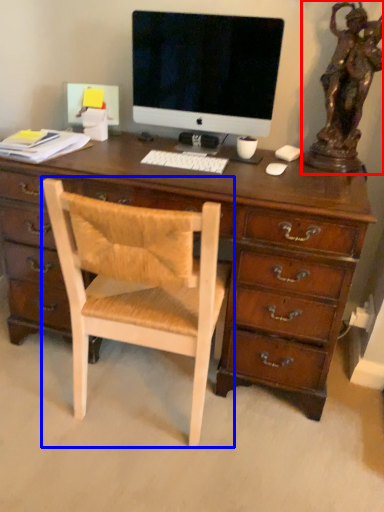
Question: Which object appears closest to the camera in this image, bronze statue (highlighted by a red box) or chair (highlighted by a blue box)?

Choices:
 (A) bronze statue
 (B) chair

Answer: (B)